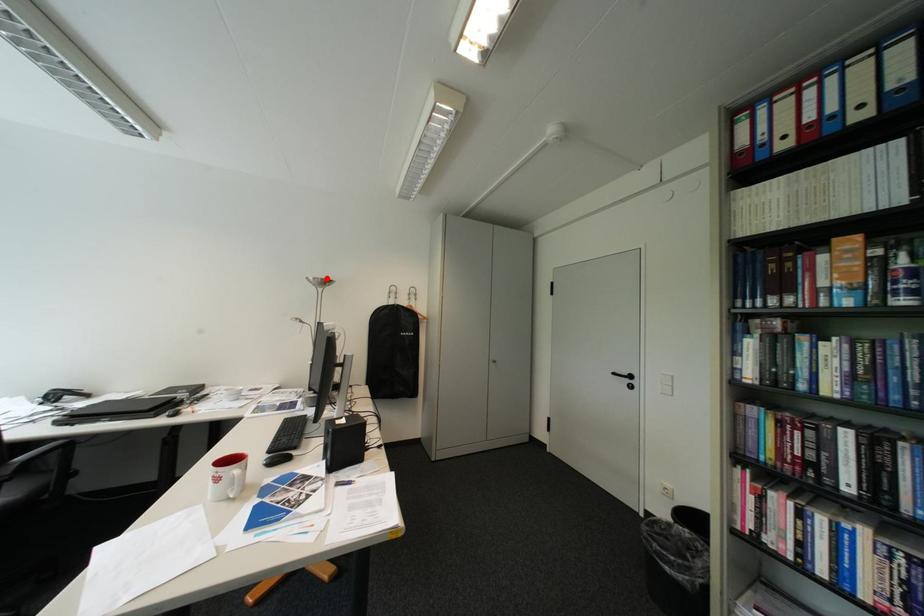
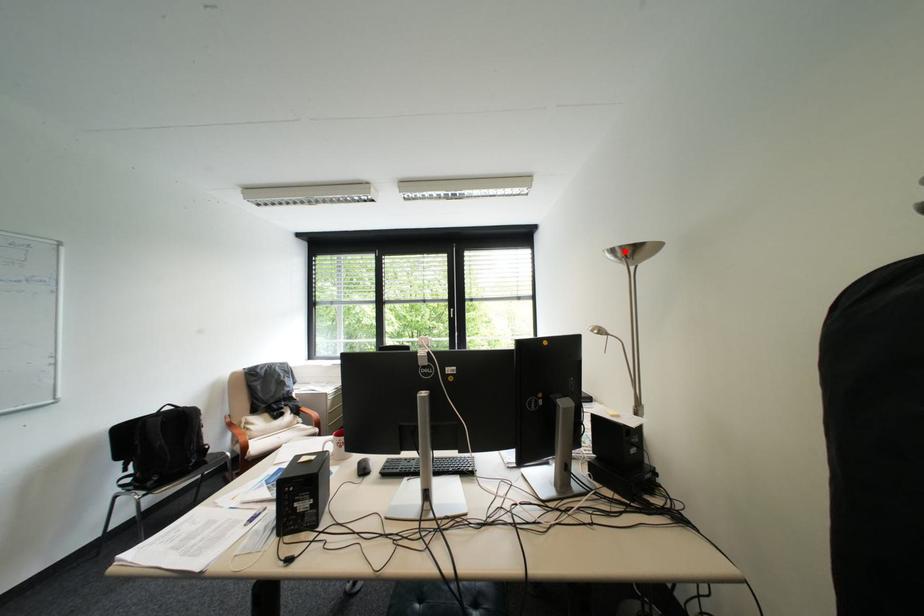
I am providing you with two images of the same scene from different viewpoints. A red point is marked on the first image and another point is marked on the second image. Do the highlighted points in image1 and image2 indicate the same real-world spot?

Yes